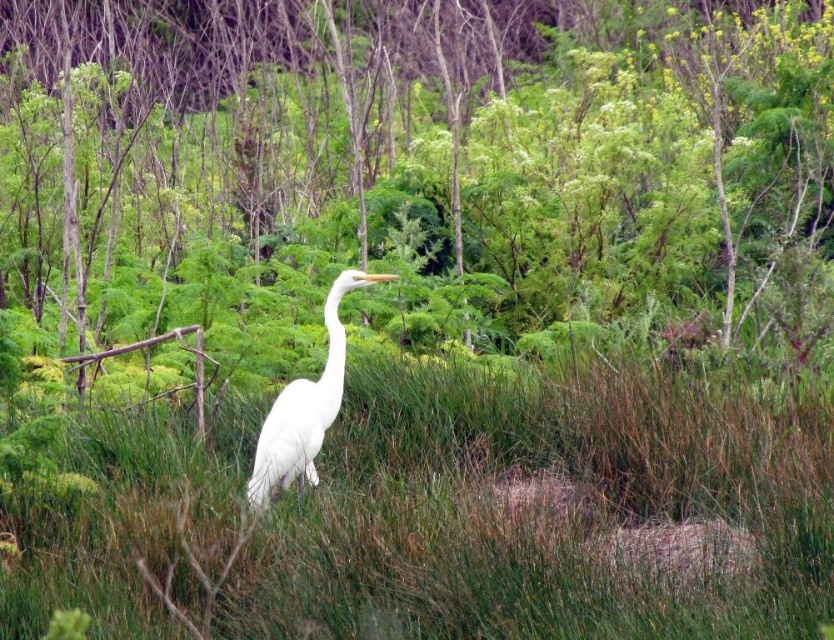
Is point (500, 200) closer to camera compared to point (797, 422)?

No, it is not.

Who is higher up, green leafy tree at center or green grassy at center?

Positioned higher is green leafy tree at center.

Who is more distant from viewer, (800, 132) or (389, 432)?

The point (800, 132) is behind.

This screenshot has width=834, height=640. Identify the location of green leafy tree at center. (423, 168).

Is green leafy tree at center below white matte bird at center?

No.

Is point (139, 177) positioned before point (330, 292)?

No, (139, 177) is behind (330, 292).

Describe the element at coordinates (423, 168) in the screenshot. This screenshot has width=834, height=640. I see `green leafy tree at center` at that location.

Find the location of `green leafy tree at center`. green leafy tree at center is located at coordinates (423, 168).

The image size is (834, 640). I want to click on green grassy at center, so click(543, 513).

Is the position of green grassy at center less distant than that of white matte bird at center?

Yes, green grassy at center is in front of white matte bird at center.

Find the location of a particular element. green grassy at center is located at coordinates point(543,513).